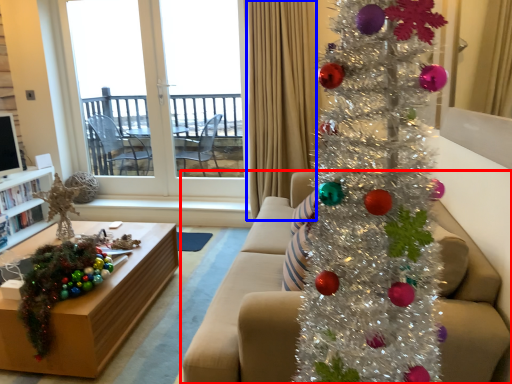
Question: Which object appears farthest to the camera in this image, studio couch (highlighted by a red box) or curtain (highlighted by a blue box)?

Choices:
 (A) studio couch
 (B) curtain

Answer: (B)